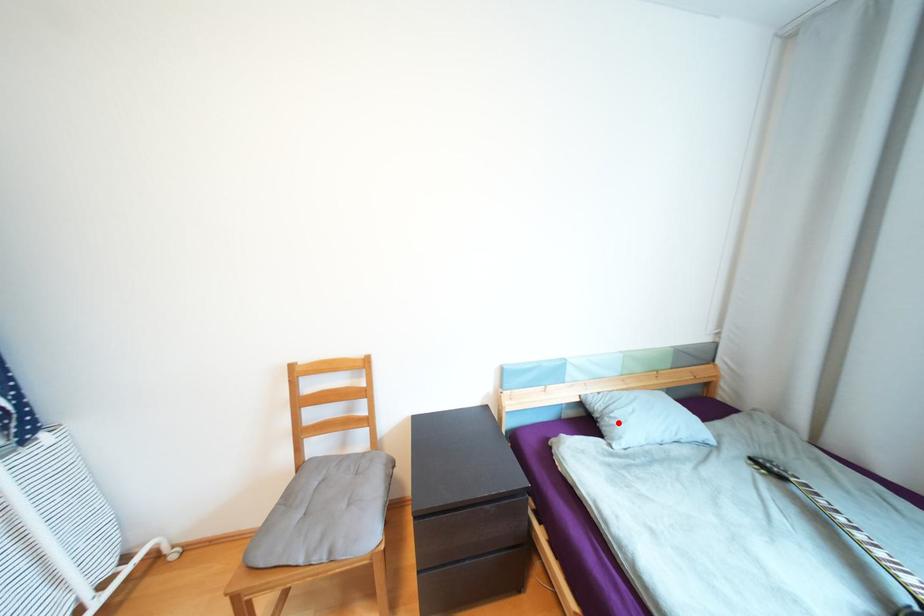
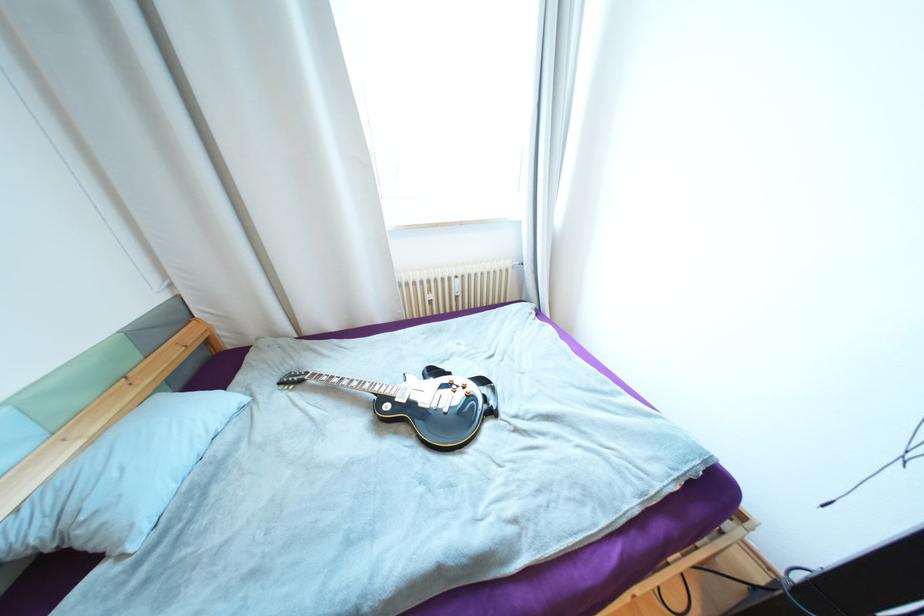
Question: I am providing you with two images of the same scene from different viewpoints. Image1 has a red point marked. In image2, the corresponding 3D location appears at what relative position? Reply with the corresponding letter.

Choices:
 (A) Closer
 (B) Farther

Answer: (A)